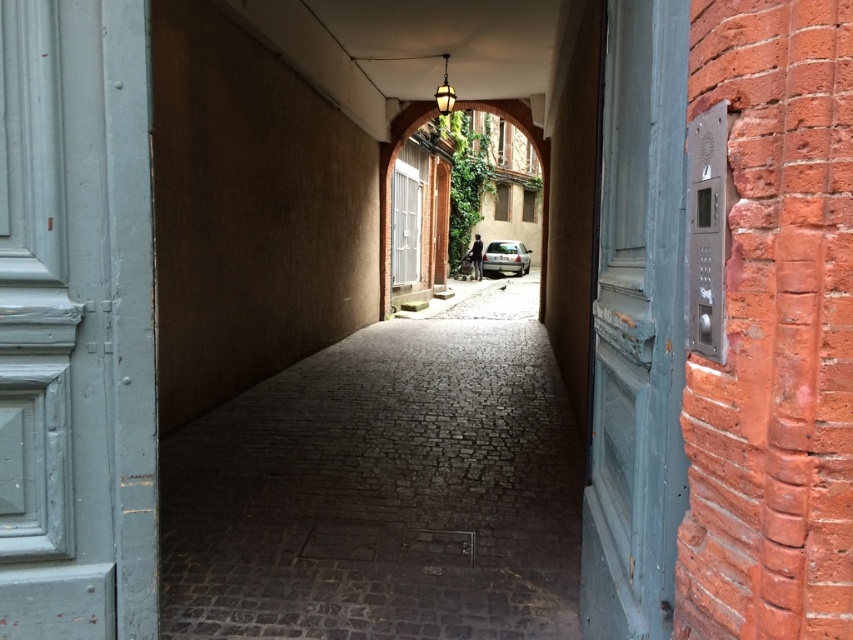
Between chipped paint door at right and silver metallic car at center, which one is positioned higher?

Positioned higher is silver metallic car at center.

Between point (616, 481) and point (490, 262), which one is positioned in front?

Point (616, 481) is in front.

Is point (666, 413) farther from viewer compared to point (498, 269)?

No, (666, 413) is closer to viewer.

Find the location of a particular element. chipped paint door at right is located at coordinates (637, 328).

Does gray cobblestone path at center appear under silver metallic car at center?

Indeed, gray cobblestone path at center is positioned under silver metallic car at center.

Who is more distant from viewer, (213,424) or (509,241)?

Positioned behind is point (509,241).

Identify the location of gray cobblestone path at center. (383, 490).

Consider the image. Does brown stone archway at center appear on the right side of silver metallic car at center?

In fact, brown stone archway at center is to the left of silver metallic car at center.

Identify the location of brown stone archway at center. (390, 184).

Does point (544, 196) come behind point (500, 241)?

No, (544, 196) is in front of (500, 241).

At what (x,y) coordinates should I click in order to perform the action: click on brown stone archway at center. Please return your answer as a coordinate pair (x, y). This screenshot has width=853, height=640. Looking at the image, I should click on [390, 184].